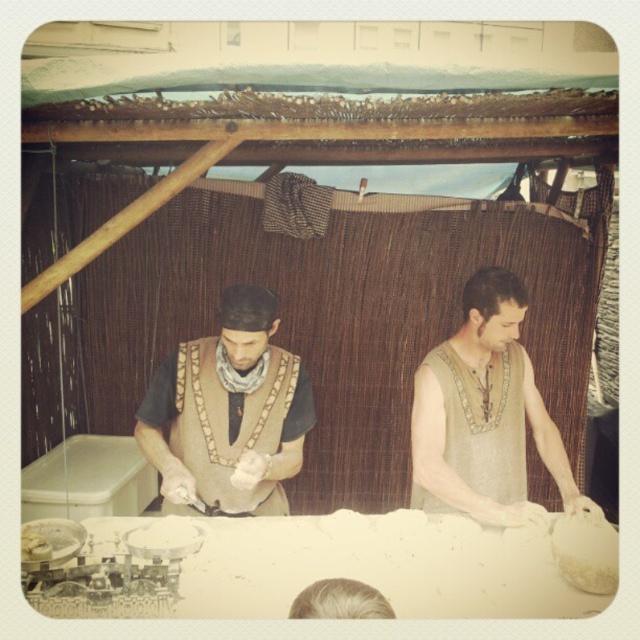
Question: Which is farther from the brown woven vest at center?

Choices:
 (A) beige woven vest at right
 (B) beige linen shirt at center
 (C) white matte table at center
 (D) white flour at center

Answer: (D)

Question: Which of the following is the closest to the observer?

Choices:
 (A) beige linen shirt at center
 (B) beige woven vest at right
 (C) brown woven vest at center

Answer: (C)

Question: Which object appears farthest from the camera in this image?

Choices:
 (A) beige woven vest at right
 (B) white flour at center

Answer: (A)

Question: Is beige woven vest at right wider than white flour at center?

Choices:
 (A) yes
 (B) no

Answer: (A)

Question: Is white matte table at center closer to camera compared to brown woven vest at center?

Choices:
 (A) no
 (B) yes

Answer: (B)

Question: Does beige linen shirt at center lie behind white flour at center?

Choices:
 (A) no
 (B) yes

Answer: (B)